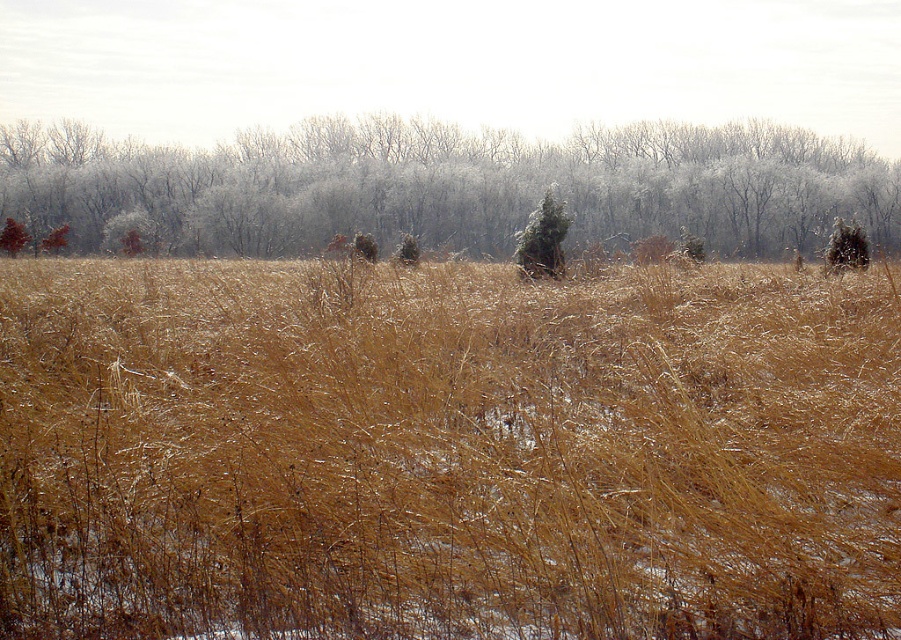
Between point (856, 564) and point (545, 216), which one is positioned behind?

Positioned behind is point (545, 216).

Which of these two, brown dry grass at center or green textured pine at center, stands shorter?

green textured pine at center

Which is in front, point (614, 547) or point (545, 211)?

Point (614, 547)

Identify the location of brown dry grass at center. The height and width of the screenshot is (640, 901). (446, 451).

Identify the location of brown dry grass at center. The width and height of the screenshot is (901, 640). (446, 451).

Does brown dry grass at center lie in front of frosted white tree at center?

Yes, brown dry grass at center is in front of frosted white tree at center.

You are a GUI agent. You are given a task and a screenshot of the screen. Output one action in this format:
    pyautogui.click(x=<x>, y=<y>)
    Task: Click on the brown dry grass at center
    
    Given the screenshot: What is the action you would take?
    pyautogui.click(x=446, y=451)

At what (x,y) coordinates should I click in order to perform the action: click on brown dry grass at center. Please return your answer as a coordinate pair (x, y). Looking at the image, I should click on (446, 451).

Does frosted white tree at center have a lesser width compared to green textured pine at center?

In fact, frosted white tree at center might be wider than green textured pine at center.

Is frosted white tree at center to the left of green textured pine at center from the viewer's perspective?

Correct, you'll find frosted white tree at center to the left of green textured pine at center.

Who is more forward, (460, 227) or (538, 230)?

Positioned in front is point (538, 230).

Locate an element on the screen. Image resolution: width=901 pixels, height=640 pixels. frosted white tree at center is located at coordinates (446, 186).